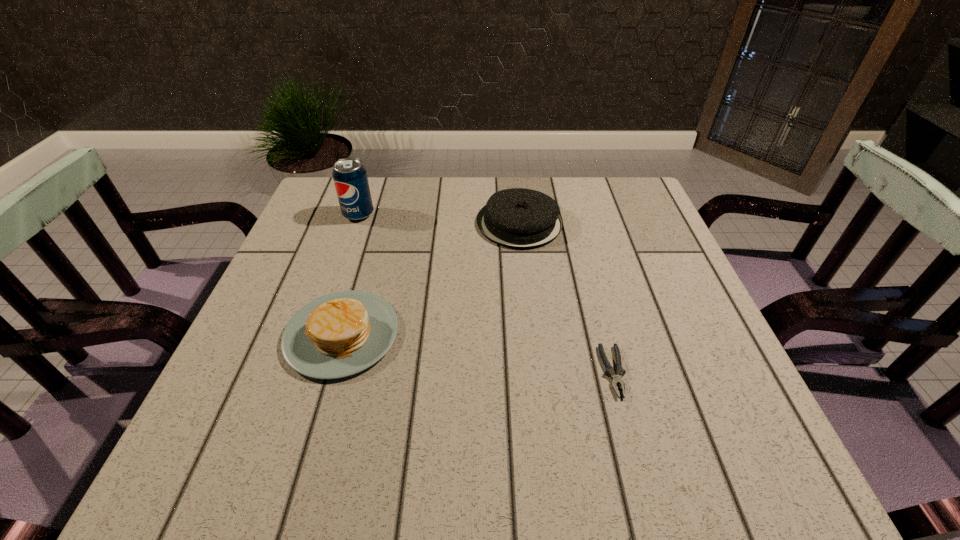
In the image, there is a desktop. At what (x,y) coordinates should I click in order to perform the action: click on vacant space at the far right corner. Please return your answer as a coordinate pair (x, y). The height and width of the screenshot is (540, 960). Looking at the image, I should click on (614, 191).

You are a GUI agent. You are given a task and a screenshot of the screen. Output one action in this format:
    pyautogui.click(x=<x>, y=<y>)
    Task: Click on the free space that is in between the tallest object and the right pancake
    This screenshot has width=960, height=540.
    Given the screenshot: What is the action you would take?
    pyautogui.click(x=439, y=219)

Where is `unoccupied position between the farther pancake and the tallest object`? unoccupied position between the farther pancake and the tallest object is located at coordinates (439, 219).

Find the location of a particular element. This screenshot has height=540, width=960. vacant space that's between the nearer pancake and the soda can is located at coordinates (350, 274).

Find the location of a particular element. The image size is (960, 540). free space between the right pancake and the left pancake is located at coordinates (431, 279).

Image resolution: width=960 pixels, height=540 pixels. What are the coordinates of `vacant space that's between the soda can and the rightmost object` in the screenshot? It's located at (486, 293).

Where is `vacant space in between the left pancake and the tallest object`? The height and width of the screenshot is (540, 960). vacant space in between the left pancake and the tallest object is located at coordinates (350, 274).

Where is `vacant point located between the second object from right to left and the soda can`? This screenshot has height=540, width=960. vacant point located between the second object from right to left and the soda can is located at coordinates (439, 219).

I want to click on free space between the rightmost object and the right pancake, so click(566, 297).

The width and height of the screenshot is (960, 540). Identify the location of free area in between the nearer pancake and the farther pancake. (431, 279).